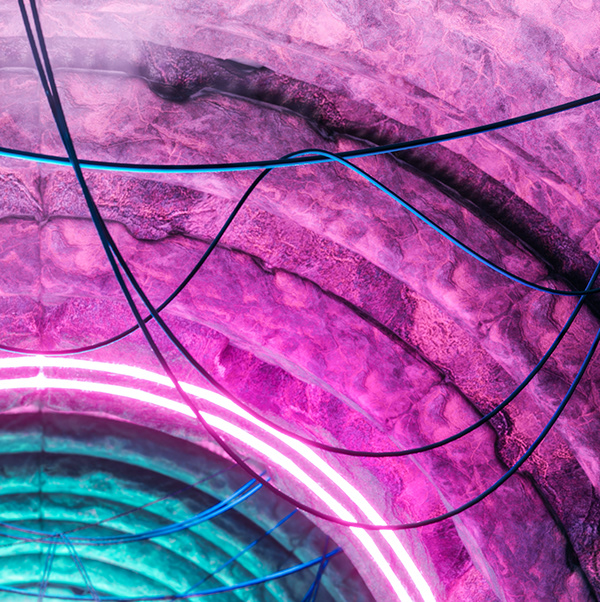
Where is `wires`? wires is located at coordinates 128,293, 147,303, 162,308, 228,165.